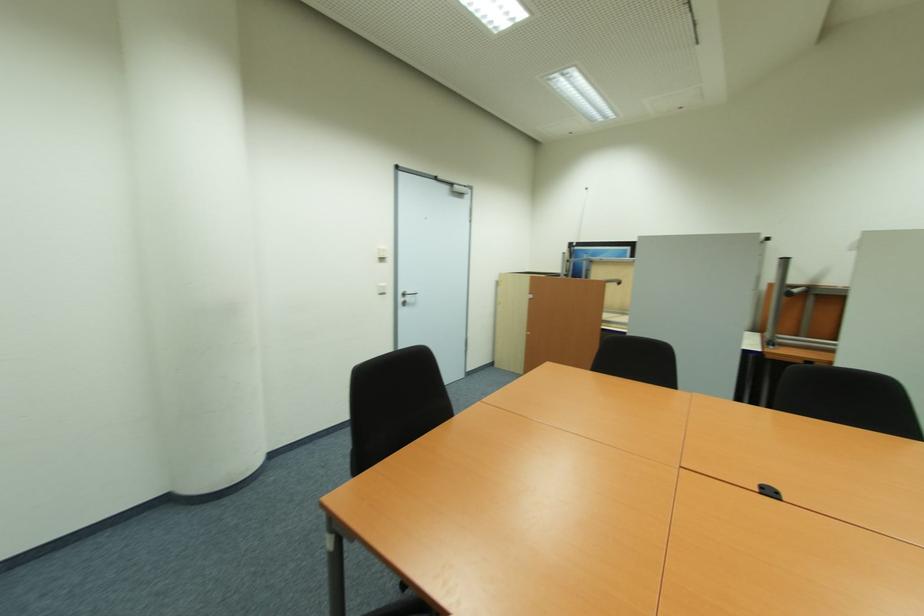
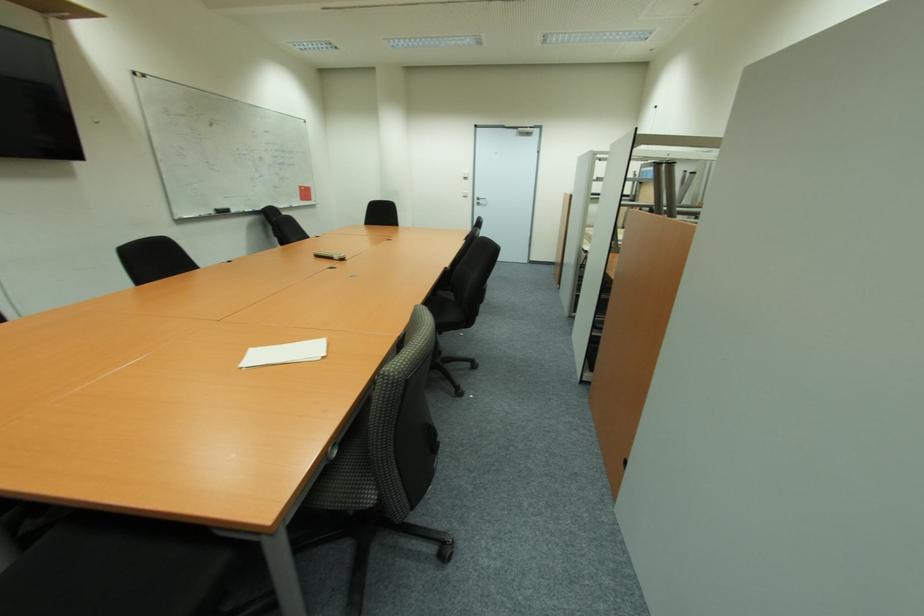
Locate, in the second image, the point that corresponds to point (381, 260) in the first image.

(467, 179)